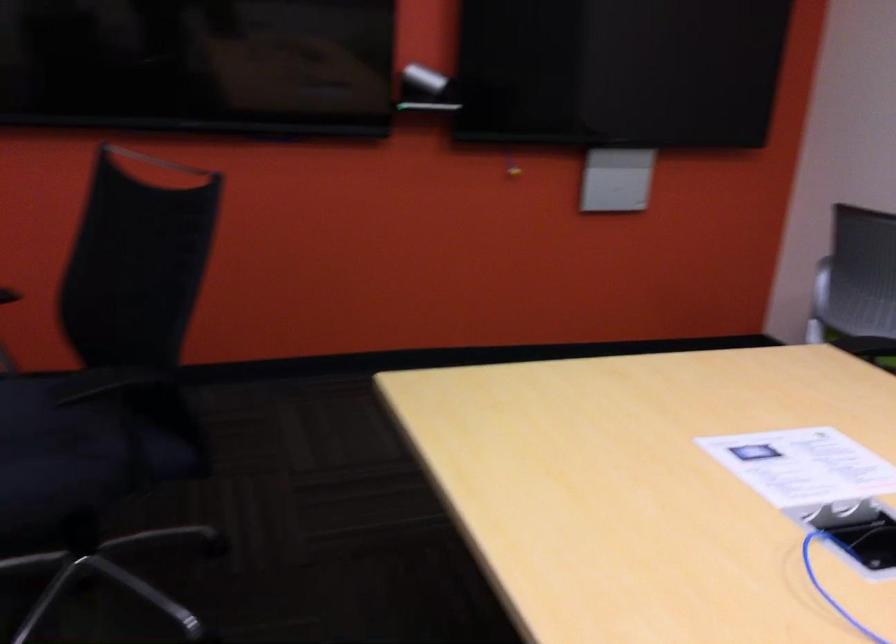
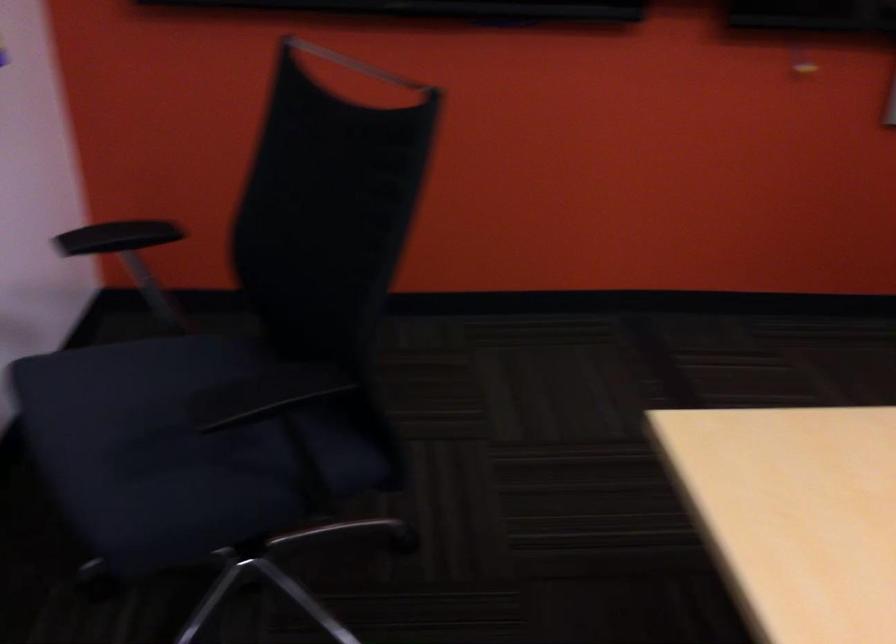
In the second image, find the point that corresponds to the point at 143,171 in the first image.

(356, 64)